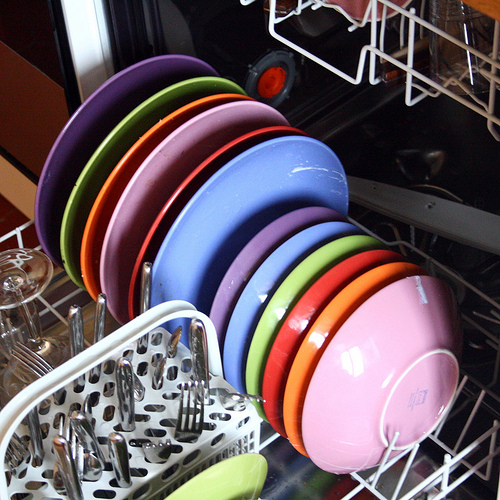
Find the location of `fork`. fork is located at coordinates (191, 423), (159, 456), (22, 457), (30, 359), (245, 397).